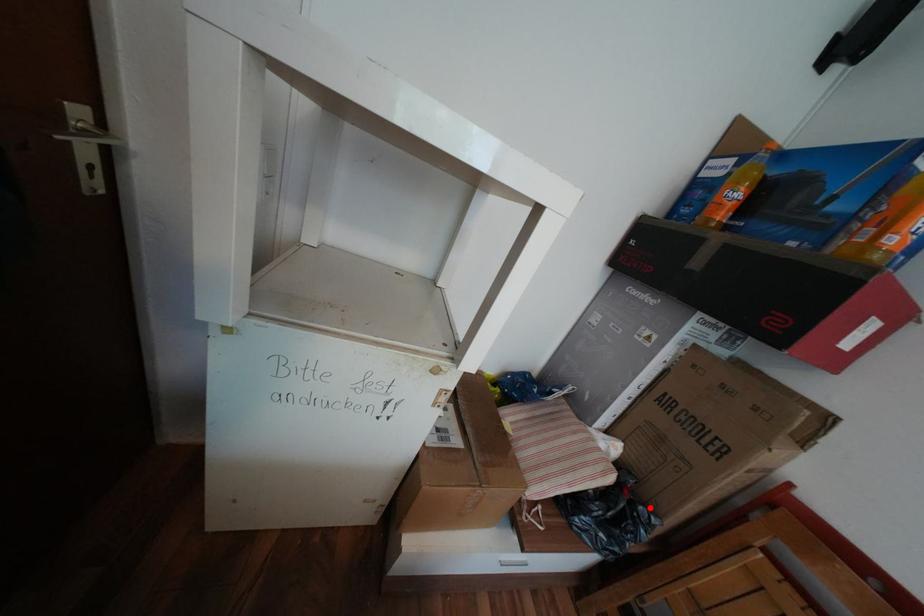
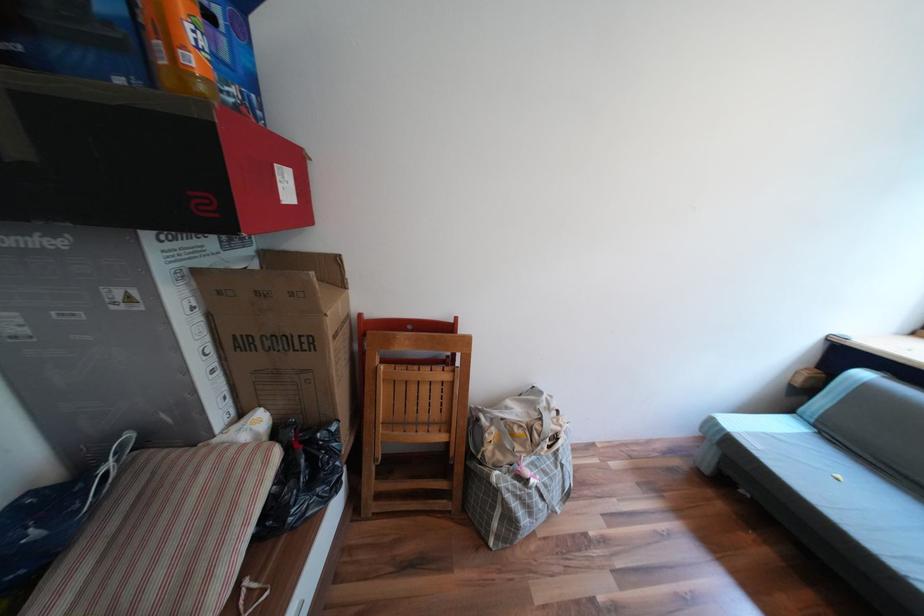
Question: I am providing you with two images of the same scene from different viewpoints. Image1 has a red point marked. In image2, the corresponding 3D location appears at what relative position? Reply with the corresponding letter.

Choices:
 (A) Closer
 (B) Farther

Answer: (A)